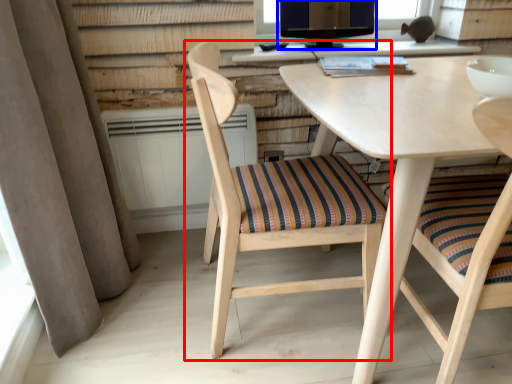
Question: Which point is closer to the camera, chair (highlighted by a red box) or computer monitor (highlighted by a blue box)?

Choices:
 (A) chair
 (B) computer monitor

Answer: (A)